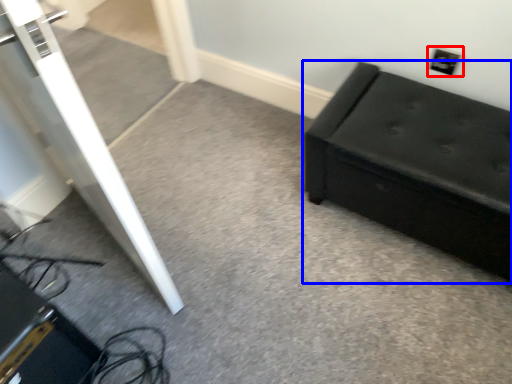
Question: Which point is further to the camera, electric outlet (highlighted by a red box) or furniture (highlighted by a blue box)?

Choices:
 (A) electric outlet
 (B) furniture

Answer: (A)